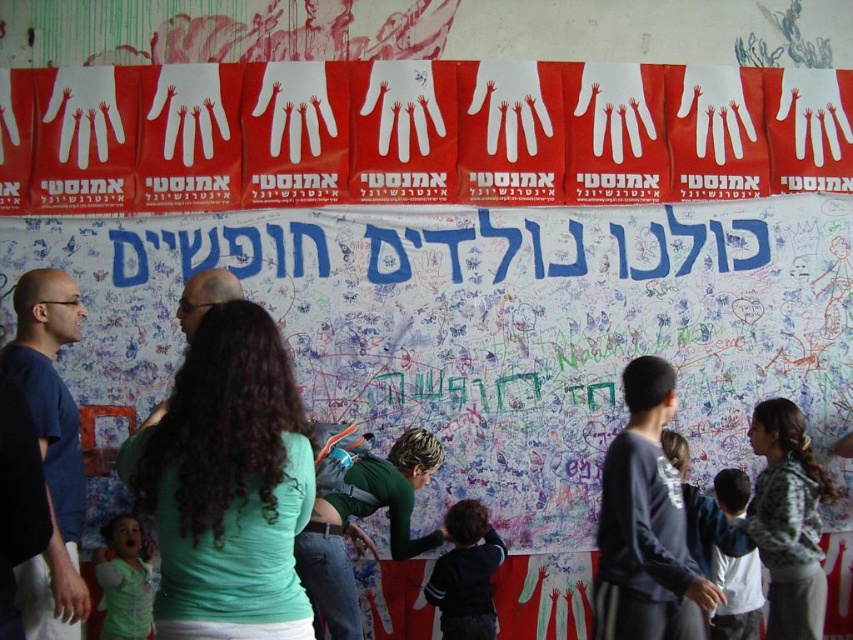
You are standing in front of the banner and notice the red paper banner at upper center and the dark blue sweater at center. Which object is taller?

The red paper banner at upper center is taller than the dark blue sweater at center.

You are standing in front of the banner and want to touch both the dark gray sweatshirt at center and the green fabric shirt at center. Which one can you reach first without moving your position?

The dark gray sweatshirt at center is closer to the viewer than the green fabric shirt at center, so you can reach it first without moving.